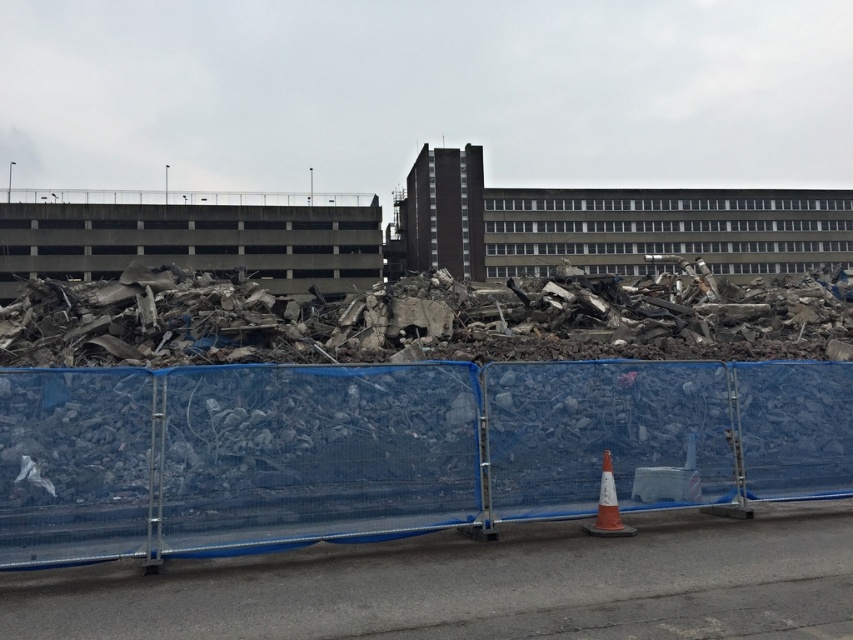
Question: Which object appears closest to the camera in this image?

Choices:
 (A) orange reflective cone at lower center
 (B) blue mesh fence at center

Answer: (B)

Question: Is the position of blue mesh fence at center more distant than that of orange reflective cone at lower center?

Choices:
 (A) yes
 (B) no

Answer: (B)

Question: Is blue mesh fence at center smaller than orange reflective cone at lower center?

Choices:
 (A) no
 (B) yes

Answer: (B)

Question: Does blue mesh fence at center appear on the right side of orange reflective cone at lower center?

Choices:
 (A) no
 (B) yes

Answer: (A)